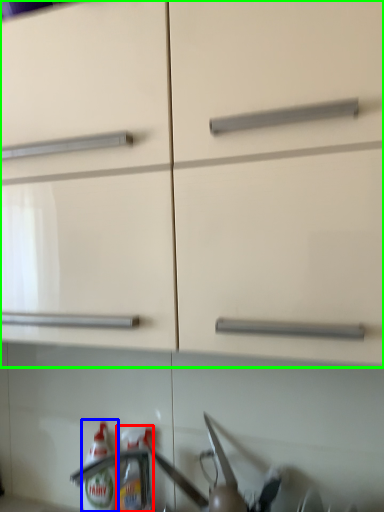
Question: Based on their relative distances, which object is nearer to bottle (highlighted by a red box)? Choose from bottle (highlighted by a blue box) and cabinetry (highlighted by a green box).

Choices:
 (A) bottle
 (B) cabinetry

Answer: (A)